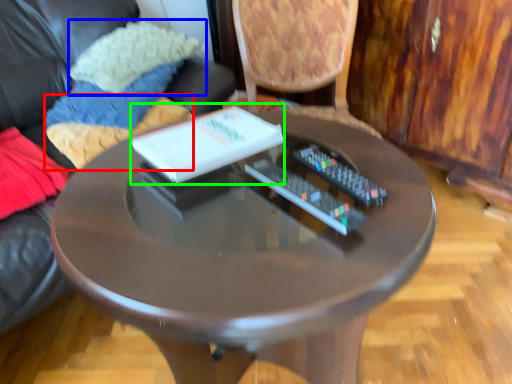
Question: Which object is positioned farthest from pillow (highlighted by a red box)? Select from pillow (highlighted by a blue box) and book (highlighted by a green box).

Choices:
 (A) pillow
 (B) book

Answer: (B)